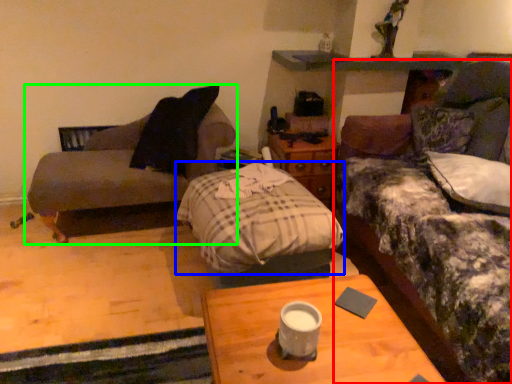
Question: Which object is the closest to the studio couch (highlighted by a red box)? Choose among these: bedding (highlighted by a blue box) or studio couch (highlighted by a green box).

Choices:
 (A) bedding
 (B) studio couch

Answer: (A)